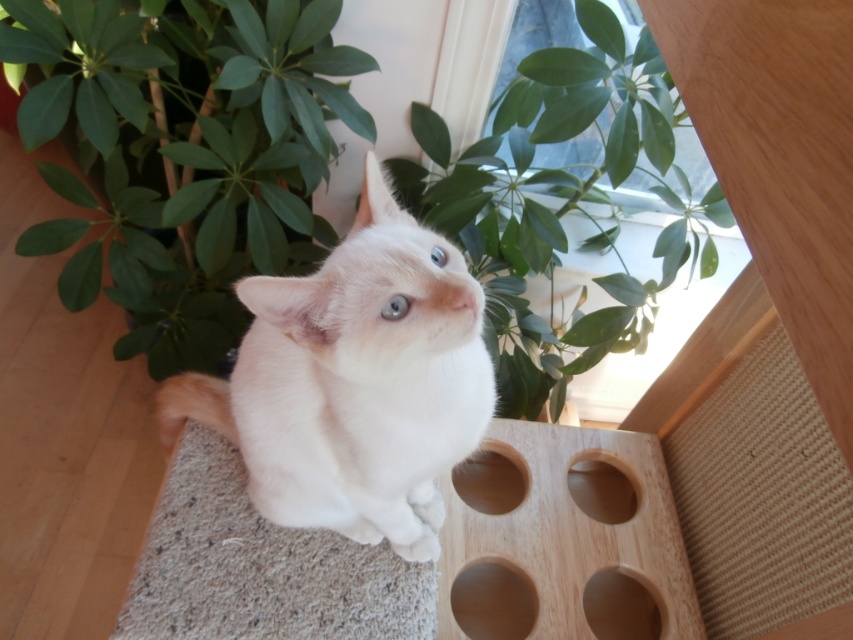
You are a photographer standing in front of the white fur cat at center. You want to take a closeup photo of the cat without moving the cat. The camera you are using has a minimum focusing distance of 28 inches. Can you take the photo from your current position?

The white fur cat at center is 27.92 inches away from viewer, which is less than the camera minimum focusing distance of 28 inches. Therefore, you cannot take the photo from your current position without moving closer or the cat moving further away.

You are a photographer standing at the camera position. You want to take a photo of the cat on the textured beige carpet. The cat is currently at point (247, 355). If you move forward 2 feet, will the cat still be in frame?

The distance between the camera and point (247, 355) is 3.34 feet. If you move forward 2 feet, the new distance will be 1.34 feet. Since the cat is still within the frame at this distance, the cat will remain in frame.

You are a cat owner who wants to ensure your cat stays safe. You notice your cat is sitting on a spot that might be unstable. Based on the image, is the white fur cat at center located above the smooth wood hole at lower center?

Yes, the white fur cat at center is positioned over smooth wood hole at lower center, which means it is directly above the hole and could be in a precarious position.